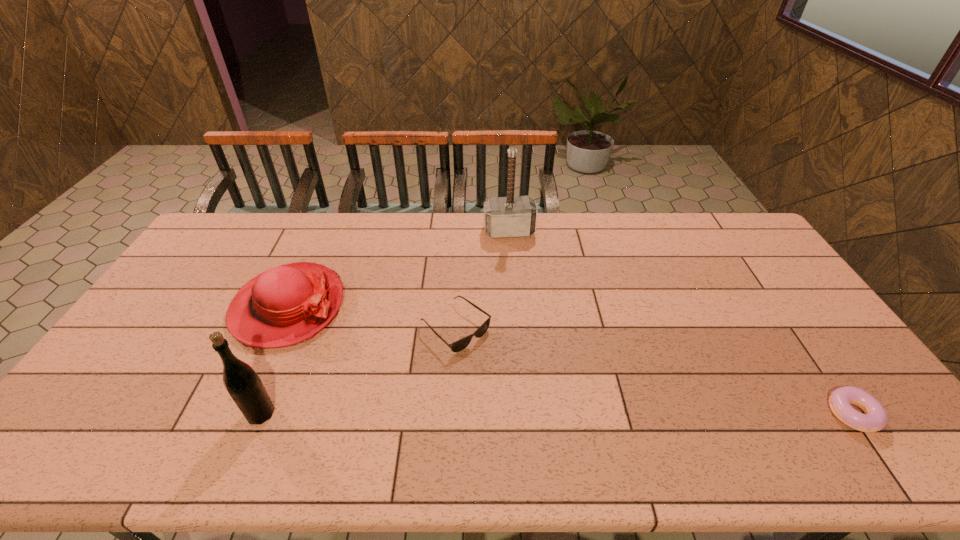
Identify the location of object that is at the near right corner. The width and height of the screenshot is (960, 540). (875, 418).

At what (x,y) coordinates should I click in order to perform the action: click on free space at the far edge of the desktop. Please return your answer as a coordinate pair (x, y). Image resolution: width=960 pixels, height=540 pixels. Looking at the image, I should click on (626, 213).

Where is `vacant area at the left edge`? This screenshot has width=960, height=540. vacant area at the left edge is located at coordinates (194, 253).

I want to click on vacant space at the right edge of the desktop, so click(745, 255).

You are a GUI agent. You are given a task and a screenshot of the screen. Output one action in this format:
    pyautogui.click(x=<x>, y=<y>)
    Task: Click on the free space at the far left corner of the desktop
    The width and height of the screenshot is (960, 540).
    Given the screenshot: What is the action you would take?
    pyautogui.click(x=213, y=238)

The height and width of the screenshot is (540, 960). Identify the location of vacant region at the near left corner. (123, 409).

Identify the location of vacant space at the far right corner of the desktop. (705, 222).

Identify the location of blank region between the rightmost object and the hammer. (681, 322).

This screenshot has width=960, height=540. I want to click on free space between the hammer and the hat, so click(398, 269).

The height and width of the screenshot is (540, 960). I want to click on vacant area that lies between the rightmost object and the third shortest object, so click(x=570, y=360).